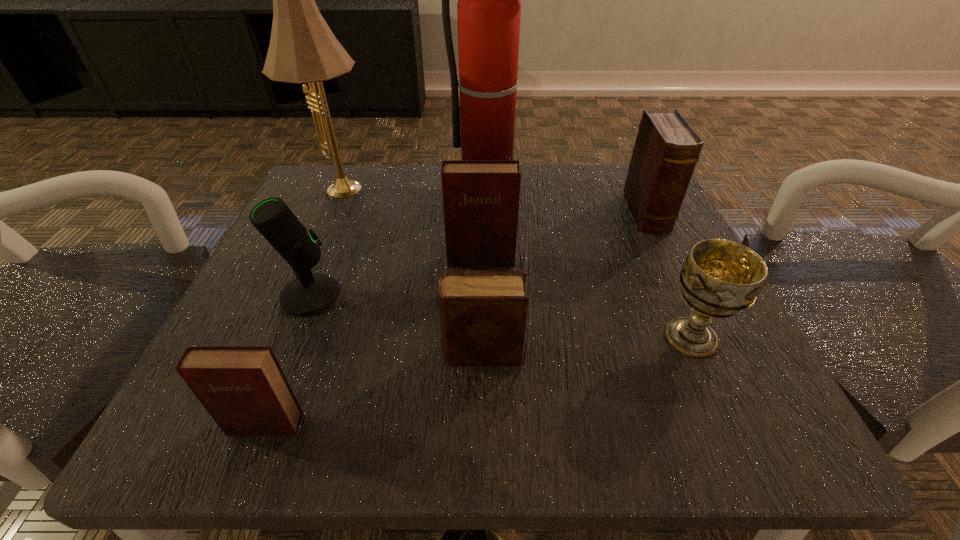
You are a GUI agent. You are given a task and a screenshot of the screen. Output one action in this format:
    pyautogui.click(x=<x>, y=<y>)
    Task: Click on the fire extinguisher
    
    Given the screenshot: What is the action you would take?
    pyautogui.click(x=489, y=8)

Identify the location of lampshade. (303, 49).

In order to click on the bigger brown diary in this screenshot , I will do `click(666, 150)`.

This screenshot has width=960, height=540. I want to click on the farthest diary, so click(x=666, y=150).

Where is `the farther reddish-brown diary`? The width and height of the screenshot is (960, 540). the farther reddish-brown diary is located at coordinates (480, 197).

Identify the location of the fourth farthest object. pyautogui.click(x=480, y=197).

Locate an element on the screen. The image size is (960, 540). microphone is located at coordinates (309, 294).

Find the location of a particular element. This screenshot has height=540, width=960. white chalice is located at coordinates (719, 278).

The image size is (960, 540). In order to click on the third farthest diary in this screenshot , I will do `click(482, 314)`.

The width and height of the screenshot is (960, 540). Find the location of `the smaller brown diary`. the smaller brown diary is located at coordinates (482, 314).